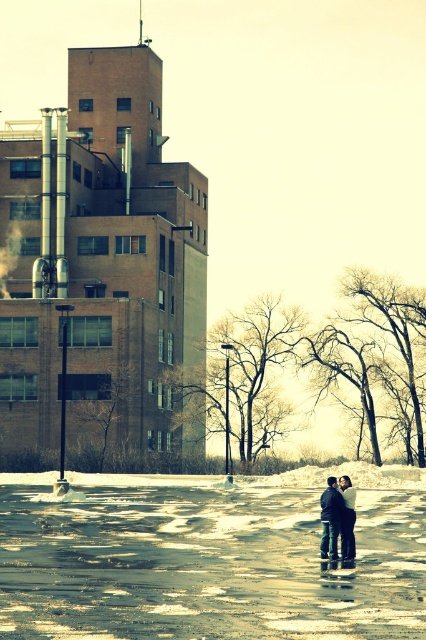
You are a photographer trying to capture the entire scene in one shot. Given that the white frosty snow at lower center and the dark blue jeans at center are both in your frame, which object would appear more prominent in the photo based on their sizes?

The white frosty snow at lower center would appear more prominent in the photo because it is larger in size than the dark blue jeans at center.

You are a photographer trying to capture the scene of the urban winter. You want to ensure that both the white frosty snow at lower center and the dark blue jeans at center are clearly visible in your photo. Based on their positions, which object should you focus on first to ensure both are in focus?

The white frosty snow at lower center is located below dark blue jeans at center. To ensure both are in focus, you should focus on the dark blue jeans at center first since it is closer to the camera, and the snow below it will naturally fall within the depth of field.